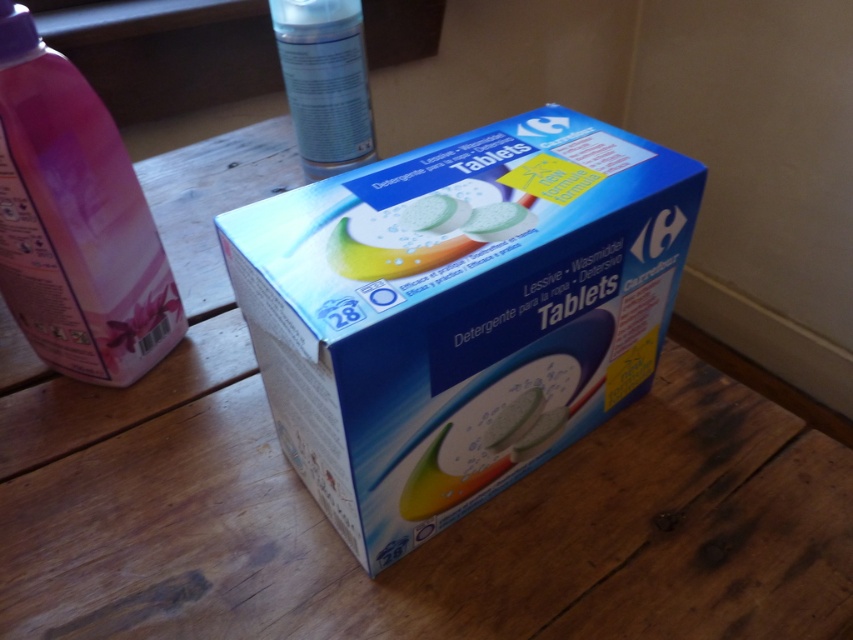
Is point (56, 100) closer to camera compared to point (349, 269)?

No, (56, 100) is behind (349, 269).

Which is in front, point (126, 312) or point (370, 272)?

Point (370, 272)

Locate an element on the screen. This screenshot has height=640, width=853. pink plastic bottle at left is located at coordinates (74, 221).

Can you confirm if blue cardboard box at center is wider than translucent plastic tablets at center?

Yes.

Is point (582, 362) closer to viewer compared to point (437, 250)?

That is False.

Identify the location of blue cardboard box at center. (457, 312).

This screenshot has width=853, height=640. What do you see at coordinates (457, 312) in the screenshot? I see `blue cardboard box at center` at bounding box center [457, 312].

Can you confirm if blue cardboard box at center is taller than pink plastic bottle at left?

Correct, blue cardboard box at center is much taller as pink plastic bottle at left.

Does point (474, 193) come closer to viewer compared to point (140, 289)?

Yes, point (474, 193) is in front of point (140, 289).

Find the location of a particular element. The width and height of the screenshot is (853, 640). blue cardboard box at center is located at coordinates (457, 312).